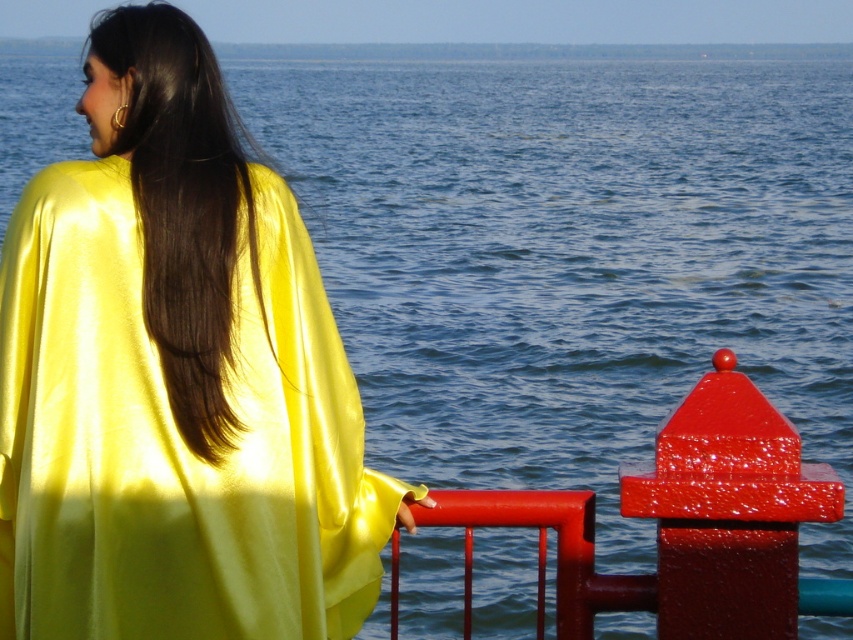
Which of these two, shiny yellow cape at upper left or satin smooth hair at upper left, stands shorter?

satin smooth hair at upper left is shorter.

Looking at this image, measure the distance between shiny yellow cape at upper left and camera.

The distance of shiny yellow cape at upper left from camera is 5.11 meters.

Locate an element on the screen. shiny yellow cape at upper left is located at coordinates (175, 378).